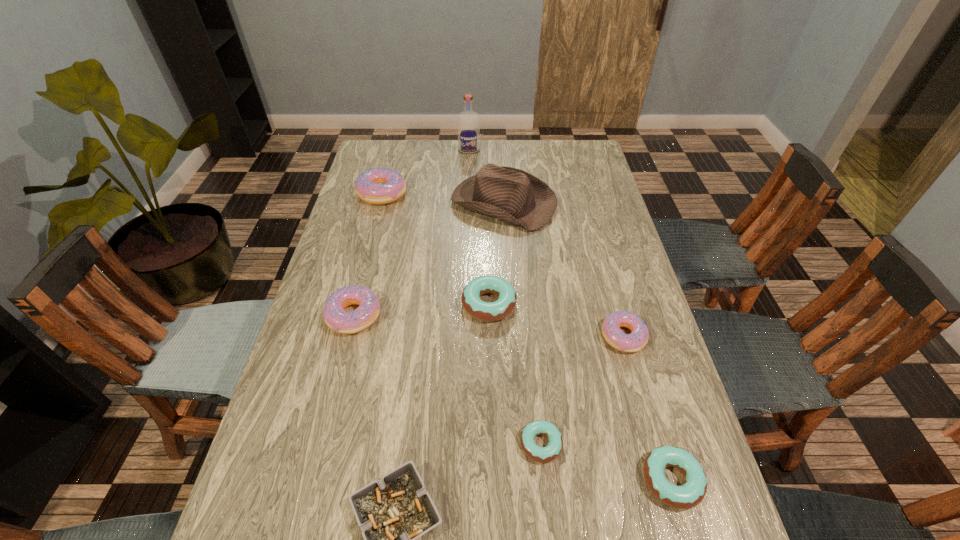
Identify which object is the sixth closest to the biggest blue doughnut. Please provide its 2D coordinates. Your answer should be formatted as a tuple, i.e. [(x, y)], where the tuple contains the x and y coordinates of a point satisfying the conditions above.

[(690, 494)]

Select which object is the fourth closest to the vodka. Please provide its 2D coordinates. Your answer should be formatted as a tuple, i.e. [(x, y)], where the tuple contains the x and y coordinates of a point satisfying the conditions above.

[(336, 318)]

Identify which doughnut is the fourth nearest to the eighth shortest object. Please provide its 2D coordinates. Your answer should be formatted as a tuple, i.e. [(x, y)], where the tuple contains the x and y coordinates of a point satisfying the conditions above.

[(614, 336)]

Find the location of a particular element. The height and width of the screenshot is (540, 960). doughnut that can be found as the fourth closest to the smallest pink doughnut is located at coordinates (336, 318).

Choose which pink doughnut is the third nearest neighbor to the farthest blue doughnut. Please provide its 2D coordinates. Your answer should be formatted as a tuple, i.e. [(x, y)], where the tuple contains the x and y coordinates of a point satisfying the conditions above.

[(378, 186)]

Locate an element on the screen. pink doughnut that is the second nearest to the second smallest pink doughnut is located at coordinates (614, 336).

Locate an element on the screen. Image resolution: width=960 pixels, height=540 pixels. blue doughnut that can be found as the closest to the smallest pink doughnut is located at coordinates (484, 311).

This screenshot has height=540, width=960. In order to click on blue doughnut object that ranks as the second closest to the shortest doughnut in this screenshot , I will do `click(484, 311)`.

At what (x,y) coordinates should I click in order to perform the action: click on vacant space that satisfies the following two spatial constraints: 1. on the label of the vodka; 2. on the left side of the rightmost pink doughnut. Please return your answer as a coordinate pair (x, y). This screenshot has width=960, height=540. Looking at the image, I should click on (463, 336).

Where is `free region that satisfies the following two spatial constraints: 1. on the front side of the smallest blue doughnut; 2. on the right side of the fourth tallest object`? The image size is (960, 540). free region that satisfies the following two spatial constraints: 1. on the front side of the smallest blue doughnut; 2. on the right side of the fourth tallest object is located at coordinates [322, 444].